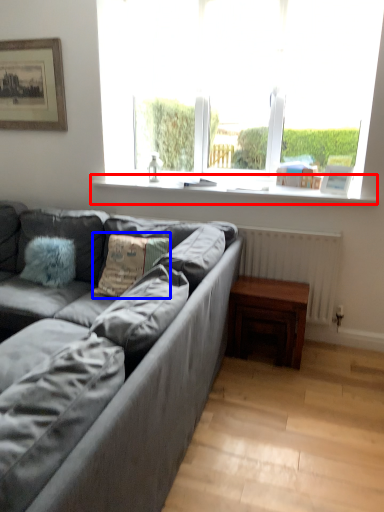
Question: Which object is further to the camera taking this photo, window sill (highlighted by a red box) or pillow (highlighted by a blue box)?

Choices:
 (A) window sill
 (B) pillow

Answer: (A)